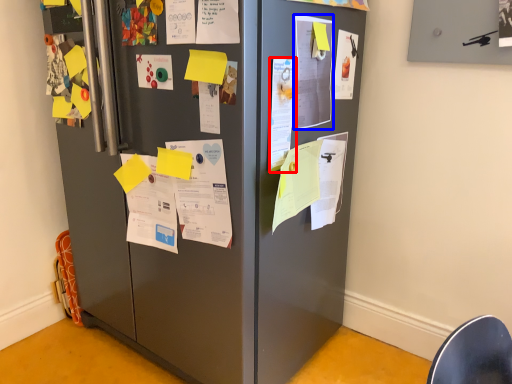
Question: Which point is closer to the camera, poster (highlighted by a red box) or poster (highlighted by a blue box)?

Choices:
 (A) poster
 (B) poster

Answer: (A)